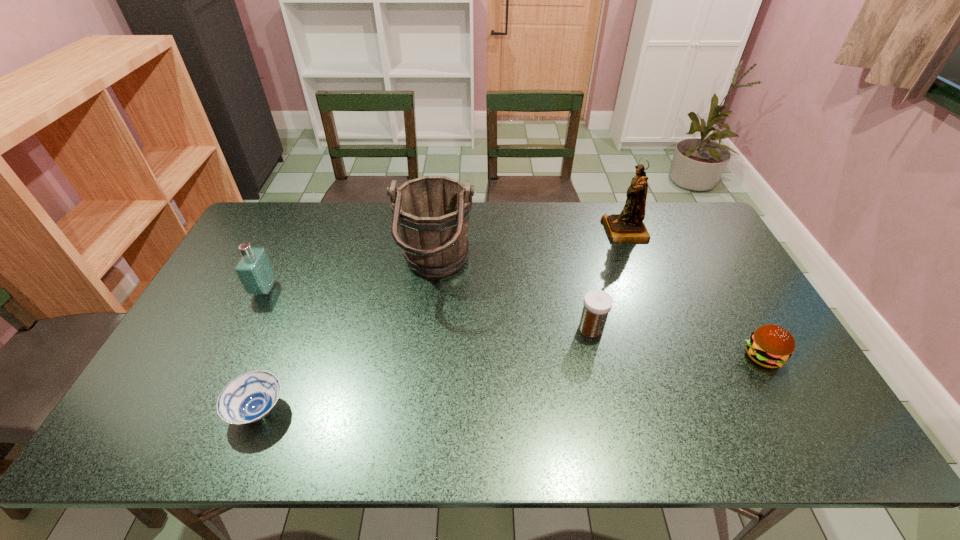
Where is `bucket`? Image resolution: width=960 pixels, height=540 pixels. bucket is located at coordinates (431, 213).

At what (x,y) coordinates should I click in order to perform the action: click on figurine. Please return your answer as a coordinate pair (x, y). The image size is (960, 540). Looking at the image, I should click on (628, 226).

Identify the location of perfume. Image resolution: width=960 pixels, height=540 pixels. (254, 269).

Find the location of a particular element. This screenshot has height=540, width=960. the third tallest object is located at coordinates pyautogui.click(x=254, y=269).

This screenshot has width=960, height=540. In order to click on the fourth object from left to right in this screenshot , I will do `click(597, 304)`.

At what (x,y) coordinates should I click in order to perform the action: click on the fourth tallest object. Please return your answer as a coordinate pair (x, y). Image resolution: width=960 pixels, height=540 pixels. Looking at the image, I should click on (597, 304).

Locate an element on the screen. the fifth tallest object is located at coordinates (770, 346).

You are a GUI agent. You are given a task and a screenshot of the screen. Output one action in this format:
    pyautogui.click(x=<x>, y=<y>)
    Task: Click on the hamburger
    The height and width of the screenshot is (540, 960).
    Given the screenshot: What is the action you would take?
    pyautogui.click(x=770, y=346)

Where is `the second object from left to right`? Image resolution: width=960 pixels, height=540 pixels. the second object from left to right is located at coordinates (250, 397).

Find the location of a particular element. The height and width of the screenshot is (540, 960). the shortest object is located at coordinates (250, 397).